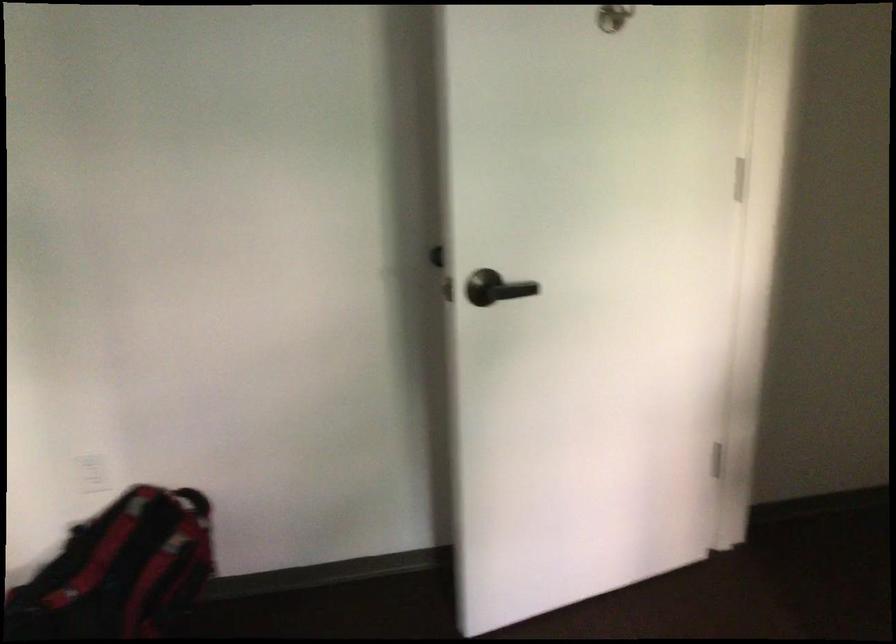
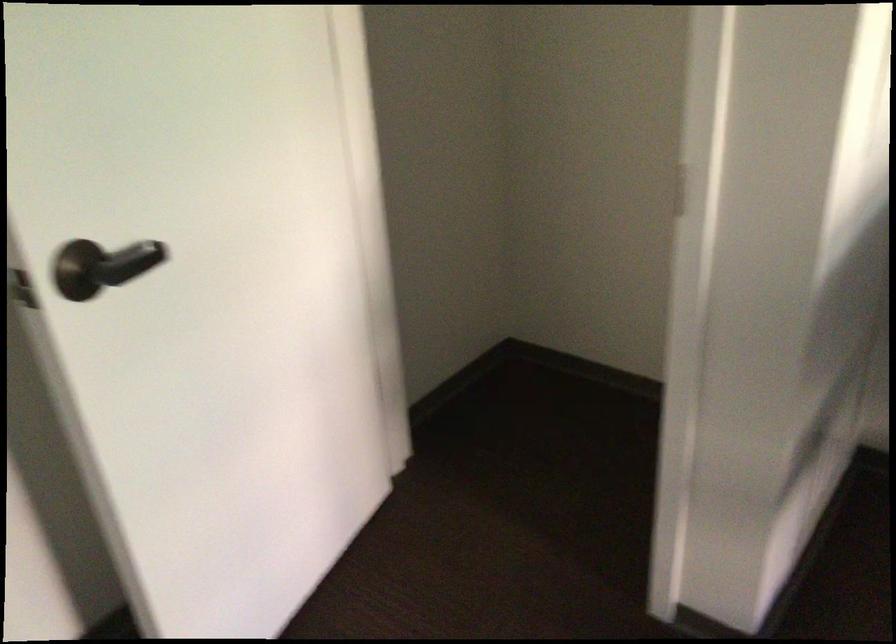
The point at (498, 286) is marked in the first image. Where is the corresponding point in the second image?

(107, 265)